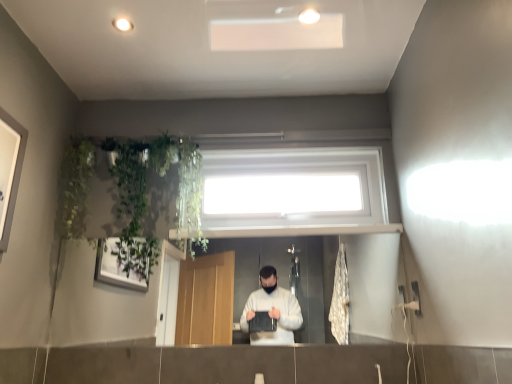
Question: From the image's perspective, is green leafy plant at upper left under white plastic window at upper center?

Choices:
 (A) yes
 (B) no

Answer: (A)

Question: From a real-world perspective, is green leafy plant at upper left positioned under white plastic window at upper center based on gravity?

Choices:
 (A) no
 (B) yes

Answer: (B)

Question: Would you say green leafy plant at upper left contains white plastic window at upper center?

Choices:
 (A) no
 (B) yes

Answer: (A)

Question: From the image's perspective, is green leafy plant at upper left located above white plastic window at upper center?

Choices:
 (A) yes
 (B) no

Answer: (B)

Question: Considering the relative positions of green leafy plant at upper left and white plastic window at upper center in the image provided, is green leafy plant at upper left to the right of white plastic window at upper center from the viewer's perspective?

Choices:
 (A) yes
 (B) no

Answer: (B)

Question: From a real-world perspective, is green leafy plant at upper left over white plastic window at upper center?

Choices:
 (A) no
 (B) yes

Answer: (A)

Question: Is white plastic window at upper center at the left side of green leafy plant at upper left?

Choices:
 (A) no
 (B) yes

Answer: (A)

Question: Considering the relative sizes of white plastic window at upper center and green leafy plant at upper left in the image provided, is white plastic window at upper center wider than green leafy plant at upper left?

Choices:
 (A) no
 (B) yes

Answer: (A)

Question: From a real-world perspective, is white plastic window at upper center on green leafy plant at upper left?

Choices:
 (A) yes
 (B) no

Answer: (A)

Question: Is white plastic window at upper center facing towards green leafy plant at upper left?

Choices:
 (A) yes
 (B) no

Answer: (B)

Question: Are white plastic window at upper center and green leafy plant at upper left beside each other?

Choices:
 (A) no
 (B) yes

Answer: (A)

Question: From a real-world perspective, is white plastic window at upper center under green leafy plant at upper left?

Choices:
 (A) yes
 (B) no

Answer: (B)

Question: From a real-world perspective, is green leafy plant at upper left physically located above or below white plastic window at upper center?

Choices:
 (A) below
 (B) above

Answer: (A)